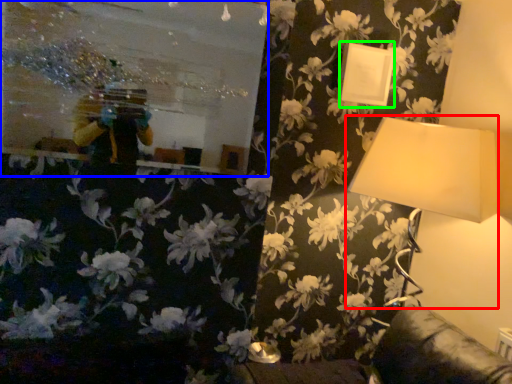
Question: Which is farther away from lamp (highlighted by a red box)? mirror (highlighted by a blue box) or picture frame (highlighted by a green box)?

Choices:
 (A) mirror
 (B) picture frame

Answer: (A)